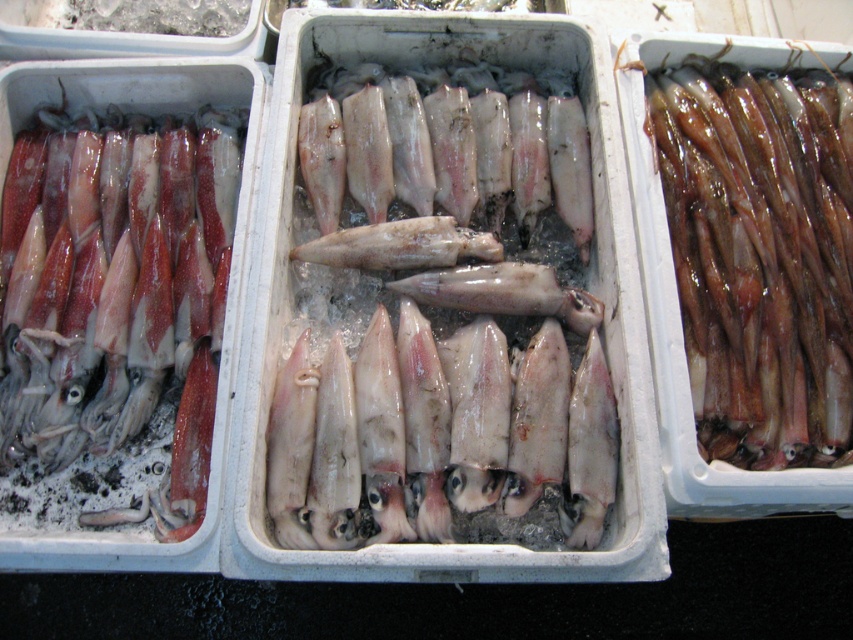
You are standing in front of three white styrofoam containers filled with squid arranged side by side on a dark surface. You notice two points marked in the image, one at coordinates point (x=407, y=280) and the other at point (x=242, y=115). Which of these two points is closer to you?

Point (x=407, y=280) is closer to the camera than point (x=242, y=115), so the point at coordinates point (x=407, y=280) is closer to you.

You are a food preparer who needs to choose between the pale white glossy squid at center and the glistening wet squid at center for a recipe that requires wider squid. Which one should you choose?

The pale white glossy squid at center might be wider than glistening wet squid at center, so you should choose the pale white glossy squid at center for the recipe that requires wider squid.

You are a delivery person who needs to place a third container between the matte red squid at left and the glistening wet squid at center. If your container is 12 inches wide, will there be enough space between them to fit it?

The distance between the matte red squid at left and the glistening wet squid at center is 31.18 inches. Since the container is 12 inches wide, there is sufficient space to place it between them.